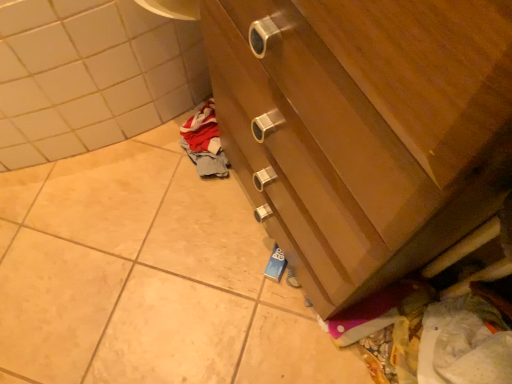
At what (x,y) coordinates should I click in order to perform the action: click on white fabric at lower left. Please return your answer as a coordinate pair (x, y). Image resolution: width=512 pixels, height=384 pixels. Looking at the image, I should click on coord(90,76).

The height and width of the screenshot is (384, 512). What do you see at coordinates (90, 76) in the screenshot?
I see `white fabric at lower left` at bounding box center [90, 76].

The height and width of the screenshot is (384, 512). I want to click on white fabric at lower left, so click(x=90, y=76).